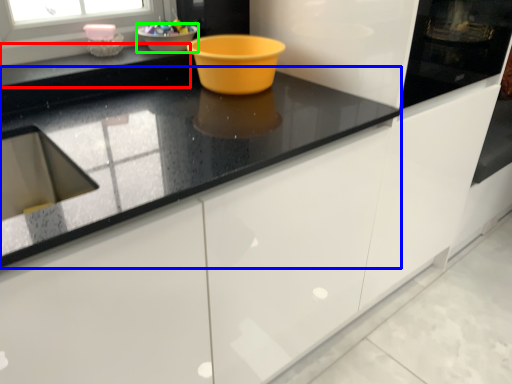
Question: Which object is positioned closest to counter top (highlighted by a red box)? Select from countertop (highlighted by a blue box) and basin (highlighted by a green box).

Choices:
 (A) countertop
 (B) basin

Answer: (B)